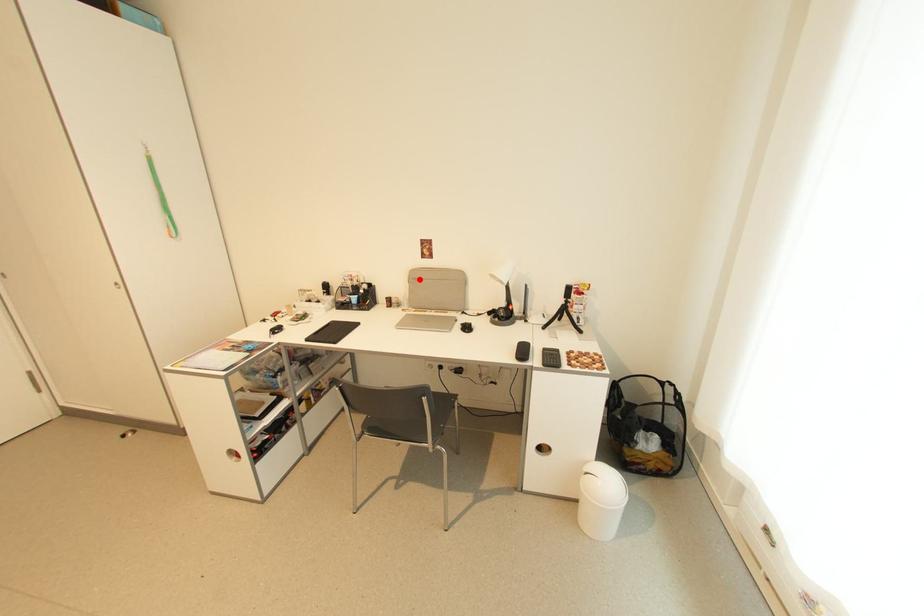
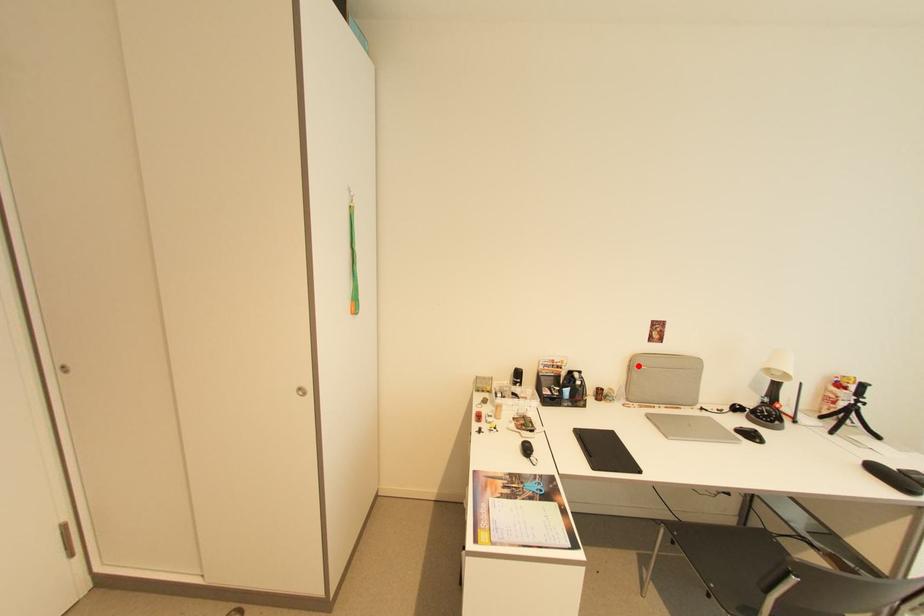
I am providing you with two images of the same scene from different viewpoints. A red point is marked on the first image and another point is marked on the second image. Is the marked point in image1 the same physical position as the marked point in image2?

Yes